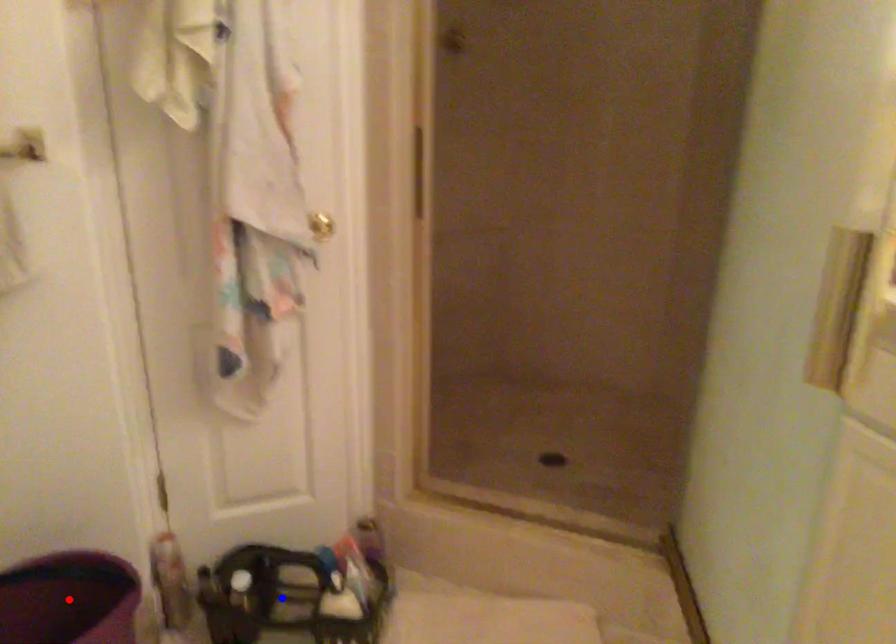
Question: In the image, two points are highlighted. Which point is nearer to the camera? Reply with the corresponding letter.

Choices:
 (A) blue point
 (B) red point

Answer: (B)